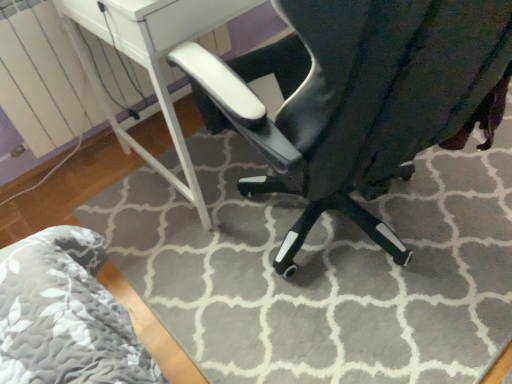
Where is `free location in front of white glossy table at center`? The image size is (512, 384). free location in front of white glossy table at center is located at coordinates (182, 269).